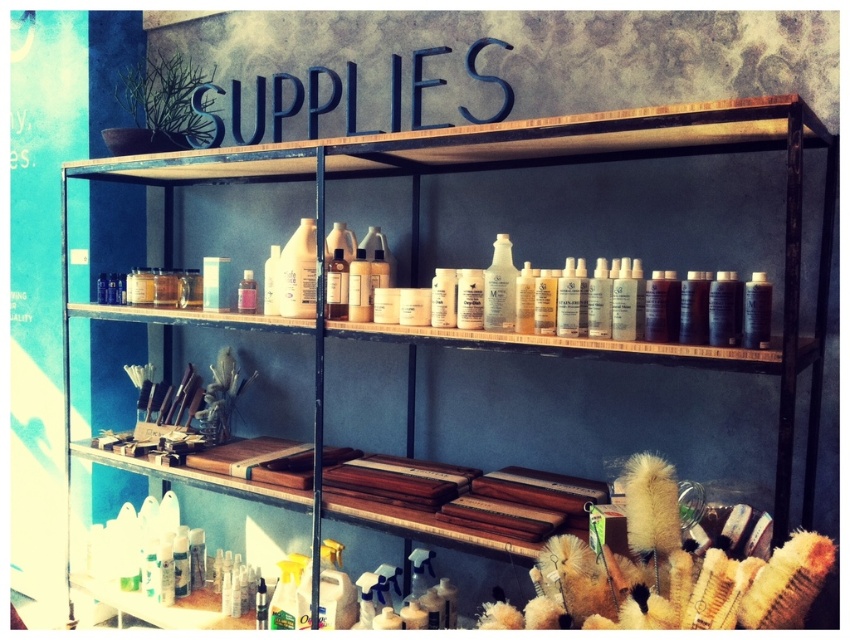
Question: Which point is farther to the camera?

Choices:
 (A) (506, 257)
 (B) (251, 296)

Answer: (B)

Question: Can you confirm if translucent plastic bottle at center is positioned to the right of pink matte jar at center?

Choices:
 (A) no
 (B) yes

Answer: (B)

Question: Is translucent plastic bottle at center positioned at the back of pink matte jar at center?

Choices:
 (A) yes
 (B) no

Answer: (B)

Question: Among these objects, which one is nearest to the camera?

Choices:
 (A) pink matte jar at center
 (B) translucent plastic bottle at center

Answer: (B)

Question: Does translucent plastic bottle at center appear on the right side of pink matte jar at center?

Choices:
 (A) yes
 (B) no

Answer: (A)